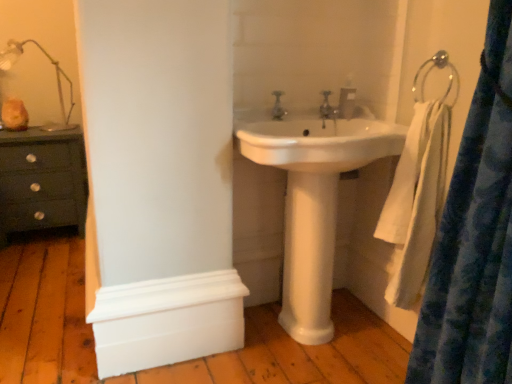
Question: From a real-world perspective, is metallic silver towel ring at upper right on top of matte silver faucet at center, positioned as the 1th tap in front-to-back order?

Choices:
 (A) yes
 (B) no

Answer: (A)

Question: Can you confirm if metallic silver towel ring at upper right is positioned to the left of matte silver faucet at center, positioned as the 1th tap in front-to-back order?

Choices:
 (A) yes
 (B) no

Answer: (B)

Question: Does metallic silver towel ring at upper right come behind matte silver faucet at center, the 2th tap from the right?

Choices:
 (A) no
 (B) yes

Answer: (A)

Question: Is metallic silver towel ring at upper right far from matte silver faucet at center, positioned as the 1th tap in front-to-back order?

Choices:
 (A) no
 (B) yes

Answer: (A)

Question: Is metallic silver towel ring at upper right outside matte silver faucet at center, marked as the 1th tap in a left-to-right arrangement?

Choices:
 (A) no
 (B) yes

Answer: (B)

Question: Is metallic silver towel ring at upper right bigger than matte silver faucet at center, positioned as the 1th tap in front-to-back order?

Choices:
 (A) yes
 (B) no

Answer: (A)

Question: From the image's perspective, is translucent glass lamp at upper left beneath white painted wood molding at lower left?

Choices:
 (A) yes
 (B) no

Answer: (B)

Question: From a real-world perspective, is translucent glass lamp at upper left under white painted wood molding at lower left?

Choices:
 (A) no
 (B) yes

Answer: (A)

Question: Is translucent glass lamp at upper left positioned in front of white painted wood molding at lower left?

Choices:
 (A) yes
 (B) no

Answer: (B)

Question: Considering the relative sizes of translucent glass lamp at upper left and white painted wood molding at lower left in the image provided, is translucent glass lamp at upper left taller than white painted wood molding at lower left?

Choices:
 (A) no
 (B) yes

Answer: (B)

Question: Is translucent glass lamp at upper left oriented towards white painted wood molding at lower left?

Choices:
 (A) no
 (B) yes

Answer: (A)

Question: Could white painted wood molding at lower left be considered to be inside translucent glass lamp at upper left?

Choices:
 (A) no
 (B) yes

Answer: (A)

Question: From a real-world perspective, is white glossy pedestal at center positioned under metallic silver towel ring at upper right based on gravity?

Choices:
 (A) no
 (B) yes

Answer: (B)